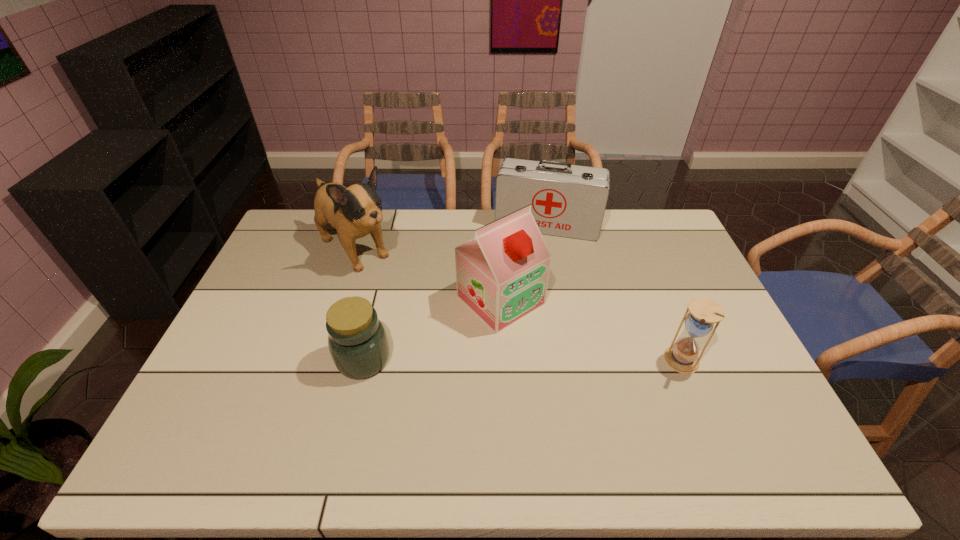
Identify the location of free space on the desktop that is between the jar and the hourglass and is positioned at the face of the puppy. This screenshot has width=960, height=540. (481, 360).

The image size is (960, 540). Identify the location of vacant spot on the desktop that is between the jar and the hourglass and is positioned on the front-facing side of the first-aid kit. (520, 360).

At what (x,y) coordinates should I click in order to perform the action: click on vacant space on the desktop that is between the jar and the hourglass and is positioned with the cap open on the soya milk. Please return your answer as a coordinate pair (x, y). The image size is (960, 540). Looking at the image, I should click on (569, 360).